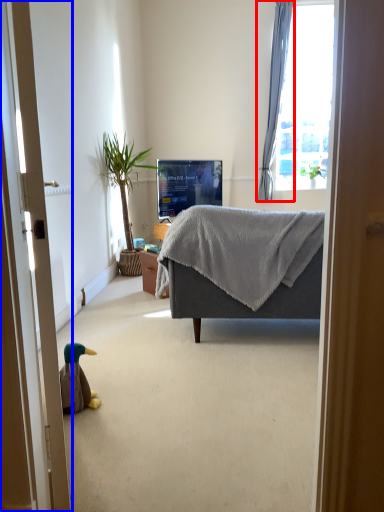
Question: Which object is further to the camera taking this photo, curtain (highlighted by a red box) or door (highlighted by a blue box)?

Choices:
 (A) curtain
 (B) door

Answer: (A)